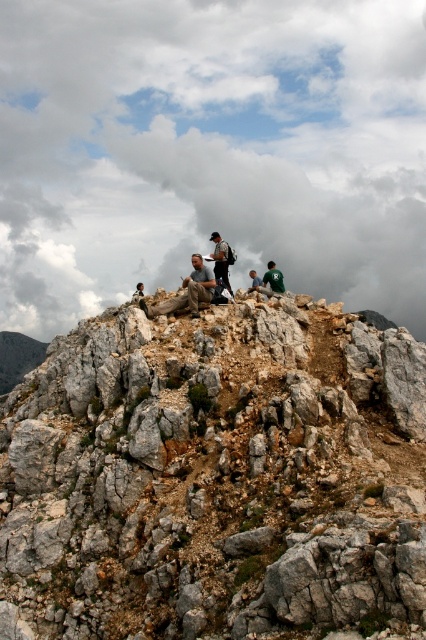
Between dark blue jeans at center and green fabric jacket at center, which one appears on the right side from the viewer's perspective?

green fabric jacket at center is more to the right.

Is dark blue jeans at center closer to the viewer compared to green fabric jacket at center?

Yes, it is in front of green fabric jacket at center.

Find the location of a particular element. The width and height of the screenshot is (426, 640). dark blue jeans at center is located at coordinates (221, 259).

Identify the location of dark blue jeans at center. This screenshot has height=640, width=426. (221, 259).

Can you confirm if green jersey at center is shorter than green fabric jacket at center?

In fact, green jersey at center may be taller than green fabric jacket at center.

Who is lower down, green jersey at center or green fabric jacket at center?

green fabric jacket at center

Between point (262, 284) and point (252, 275), which one is positioned behind?

The point (252, 275) is behind.

This screenshot has height=640, width=426. I want to click on green jersey at center, so coord(273,278).

Is matte gray rock at center bigger than green fabric jacket at center?

Incorrect, matte gray rock at center is not larger than green fabric jacket at center.

Can you confirm if matte gray rock at center is positioned below green fabric jacket at center?

Indeed, matte gray rock at center is positioned under green fabric jacket at center.

Which is behind, point (192, 307) or point (252, 276)?

The point (252, 276) is more distant.

Locate an element on the screen. The width and height of the screenshot is (426, 640). matte gray rock at center is located at coordinates (187, 291).